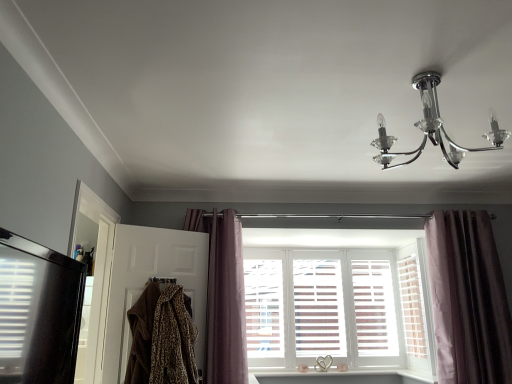
Question: Is point (159, 319) positioned closer to the camera than point (102, 226)?

Choices:
 (A) farther
 (B) closer

Answer: (B)

Question: Is leopard print fabric at lower left inside or outside of black glossy refrigerator at left, acting as the second screen door starting from the right?

Choices:
 (A) outside
 (B) inside

Answer: (A)

Question: Which object is positioned farthest from the black glossy refrigerator at left, placed as the 1th screen door when sorted from left to right?

Choices:
 (A) leopard print fabric at lower left
 (B) velvet purple curtain at right, which ranks as the second curtain in left-to-right order
 (C) clear glass chandelier at upper right
 (D) white wooden window at center
 (E) white wood shutter at center

Answer: (E)

Question: Estimate the real-world distances between objects in this image. Which object is closer to the white wood shutter at center?

Choices:
 (A) mauve velvet curtain at center, the second curtain when ordered from right to left
 (B) leopard print fabric at lower left
 (C) velvet purple curtain at right, the first curtain viewed from the right
 (D) clear glass chandelier at upper right
 (E) black glossy refrigerator at left, acting as the second screen door starting from the right

Answer: (C)